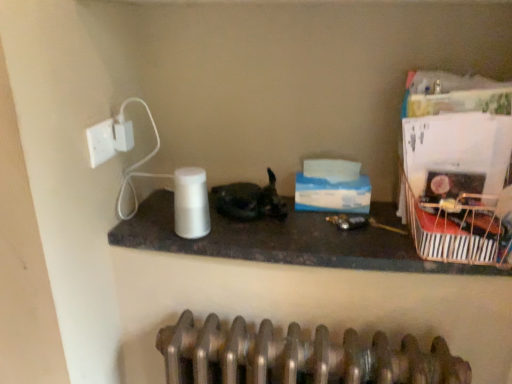
Question: Is white plastic socket at upper left shorter than metallic striped basket at right?

Choices:
 (A) yes
 (B) no

Answer: (A)

Question: Is white plastic socket at upper left behind metallic striped basket at right?

Choices:
 (A) yes
 (B) no

Answer: (A)

Question: Can you confirm if white plastic socket at upper left is wider than metallic striped basket at right?

Choices:
 (A) yes
 (B) no

Answer: (B)

Question: Is white plastic socket at upper left positioned with its back to metallic striped basket at right?

Choices:
 (A) no
 (B) yes

Answer: (A)

Question: From the image's perspective, does white plastic socket at upper left appear lower than metallic striped basket at right?

Choices:
 (A) yes
 (B) no

Answer: (B)

Question: Choose the correct answer: Is white glossy speaker at center inside shiny black cat at center or outside it?

Choices:
 (A) inside
 (B) outside

Answer: (B)

Question: Considering their positions, is white glossy speaker at center located in front of or behind shiny black cat at center?

Choices:
 (A) behind
 (B) front

Answer: (B)

Question: Is white glossy speaker at center to the left or to the right of shiny black cat at center in the image?

Choices:
 (A) right
 (B) left

Answer: (A)

Question: Considering the positions of white glossy speaker at center and shiny black cat at center in the image, is white glossy speaker at center taller or shorter than shiny black cat at center?

Choices:
 (A) tall
 (B) short

Answer: (B)

Question: Does point (401, 183) appear closer or farther from the camera than point (128, 147)?

Choices:
 (A) farther
 (B) closer

Answer: (A)

Question: Considering the positions of metallic striped basket at right and white plastic electric outlet at upper left in the image, is metallic striped basket at right wider or thinner than white plastic electric outlet at upper left?

Choices:
 (A) wide
 (B) thin

Answer: (A)

Question: Would you say metallic striped basket at right is to the left or to the right of white plastic electric outlet at upper left in the picture?

Choices:
 (A) left
 (B) right

Answer: (B)

Question: From a real-world perspective, is metallic striped basket at right physically located above or below white plastic electric outlet at upper left?

Choices:
 (A) below
 (B) above

Answer: (A)

Question: Is white matte paper towel at center in front of or behind white plastic socket at upper left in the image?

Choices:
 (A) behind
 (B) front

Answer: (A)

Question: In terms of size, does white matte paper towel at center appear bigger or smaller than white plastic socket at upper left?

Choices:
 (A) small
 (B) big

Answer: (B)